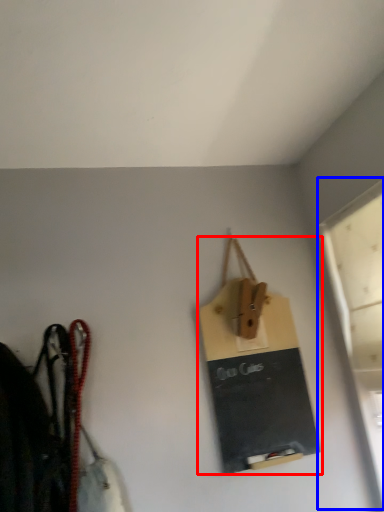
Question: Which of the following is the closest to the observer, handbag (highlighted by a red box) or window (highlighted by a blue box)?

Choices:
 (A) handbag
 (B) window

Answer: (B)